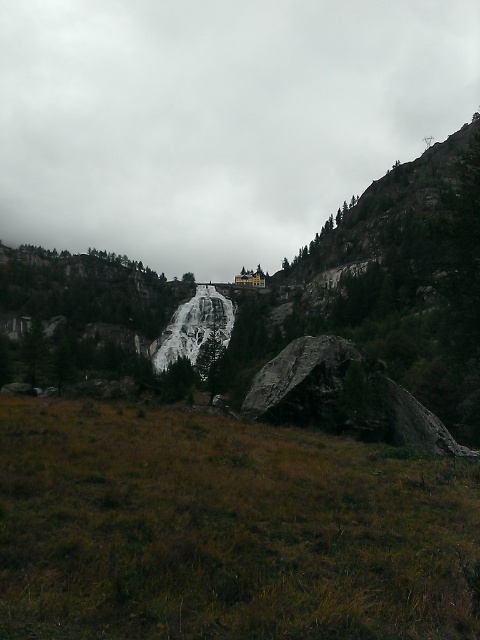
Question: Which of the following is the closest to the observer?

Choices:
 (A) (404, 436)
 (B) (437, 525)
 (C) (465, 102)

Answer: (B)

Question: Which of the following is the closest to the observer?

Choices:
 (A) brown dry grass at lower center
 (B) cloudy gray sky at upper center

Answer: (A)

Question: Is cloudy gray sky at upper center to the left of brown dry grass at lower center from the viewer's perspective?

Choices:
 (A) yes
 (B) no

Answer: (A)

Question: Estimate the real-world distances between objects in this image. Which object is farther from the cloudy gray sky at upper center?

Choices:
 (A) dark gray rock at center
 (B) brown dry grass at lower center

Answer: (B)

Question: Can you confirm if cloudy gray sky at upper center is positioned below dark gray rock at center?

Choices:
 (A) yes
 (B) no

Answer: (B)

Question: In this image, where is brown dry grass at lower center located relative to dark gray rock at center?

Choices:
 (A) right
 (B) left

Answer: (B)